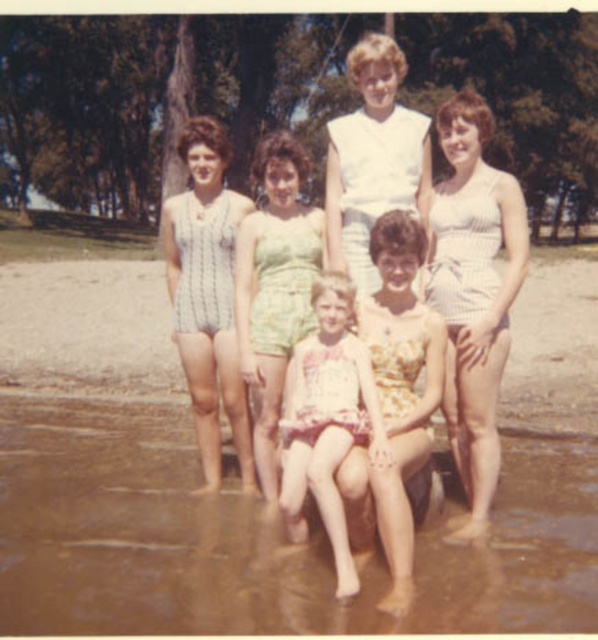
You are a photographer trying to capture a closeup of the striped fabric swimsuit at center and the white textured swimsuit at lower right. Which swimuit will appear larger in your photo?

The striped fabric swimsuit at center will appear larger in the photo because it is closer to the viewer than the white textured swimsuit at lower right.

You are standing at the edge of the water and want to take a photo of both the yellow floral dress at center and the striped fabric swimsuit at left. Which one is closer to you?

The yellow floral dress at center is closer to you because it is in front of the striped fabric swimsuit at left.

You are a photographer trying to capture a group photo of the yellow floral dress at center and the striped fabric swimsuit at left. Since you want to ensure both subjects are clearly visible, which one should you focus on first to avoid blurriness due to their size?

The yellow floral dress at center has a lesser width compared to the striped fabric swimsuit at left, so you should focus on the striped fabric swimsuit at left first because it is larger and might require more precise focusing to ensure clarity.